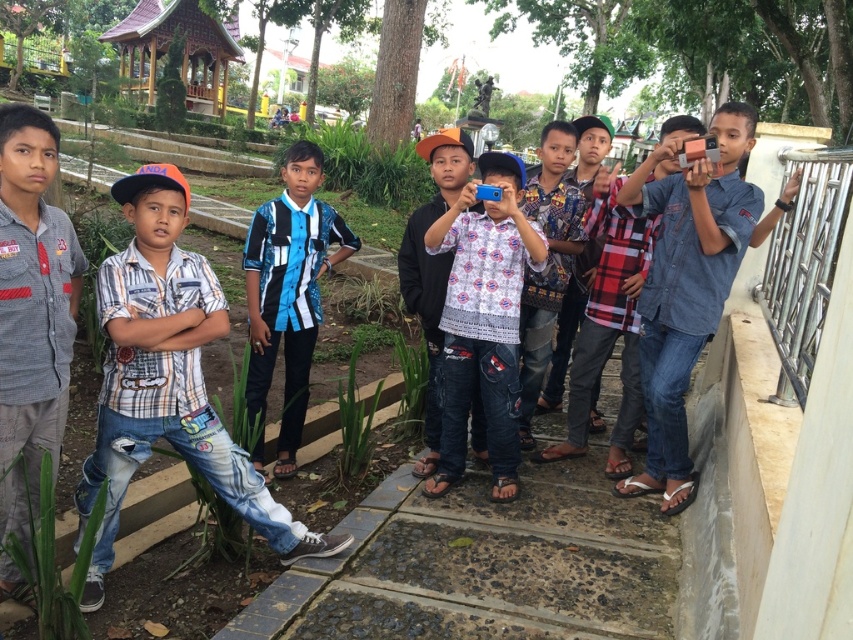
Question: Which object is farther from the camera taking this photo?

Choices:
 (A) denim jeans at right
 (B) white printed shirt at center
 (C) blue and white striped shirt at center
 (D) patterned fabric shirt at center

Answer: (D)

Question: Which point appears farthest from the camera in this image?

Choices:
 (A) (424, 314)
 (B) (33, 506)
 (C) (567, 182)
 (D) (352, 250)

Answer: (C)

Question: Which is farther from the checkered denim jeans at center?

Choices:
 (A) denim jeans at right
 (B) blue and white striped shirt at center
 (C) patterned fabric shirt at center

Answer: (A)

Question: Can you confirm if white printed shirt at center is thinner than dotted fabric shirt at center?

Choices:
 (A) no
 (B) yes

Answer: (A)

Question: Does denim jeans at right have a smaller size compared to dotted fabric shirt at center?

Choices:
 (A) yes
 (B) no

Answer: (B)

Question: Can you confirm if denim jeans at right is wider than gray cotton shirt at left?

Choices:
 (A) no
 (B) yes

Answer: (B)